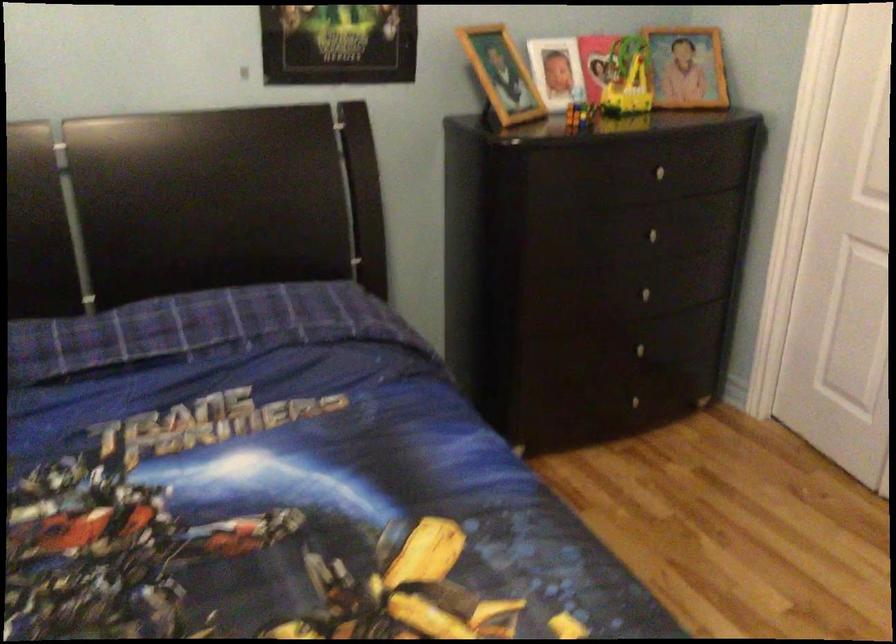
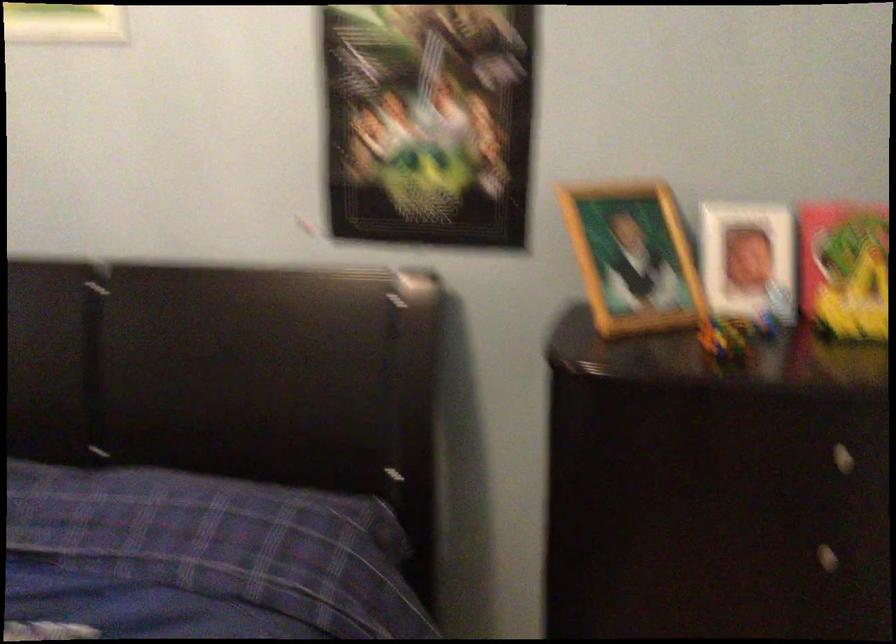
Question: I am providing you with two images of the same scene from different viewpoints. Which of the following objects are not visible in image2?

Choices:
 (A) white picture frame
 (B) drawer knob
 (C) wooden picture frame
 (D) none of these

Answer: (D)